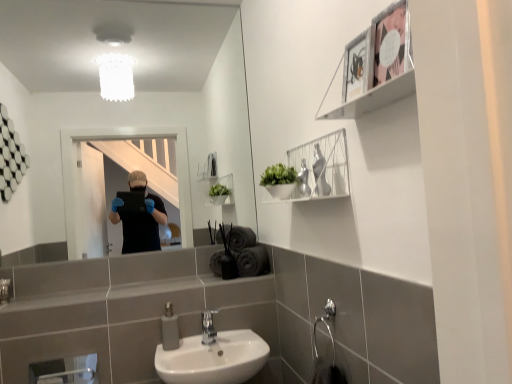
Question: Is metallic silver frame at upper right, which is the first cabinet from front to back, to the right of clear glass mirror at upper center from the viewer's perspective?

Choices:
 (A) no
 (B) yes

Answer: (B)

Question: Is metallic silver frame at upper right, which ranks as the 2th cabinet in bottom-to-top order, further to the viewer compared to clear glass mirror at upper center?

Choices:
 (A) no
 (B) yes

Answer: (A)

Question: From a real-world perspective, is metallic silver frame at upper right, which ranks as the 2th cabinet in bottom-to-top order, physically above clear glass mirror at upper center?

Choices:
 (A) no
 (B) yes

Answer: (A)

Question: From the image's perspective, would you say metallic silver frame at upper right, the first cabinet from the top, is shown under clear glass mirror at upper center?

Choices:
 (A) no
 (B) yes

Answer: (B)

Question: Is metallic silver frame at upper right, the 2th cabinet positioned from the back, next to clear glass mirror at upper center and touching it?

Choices:
 (A) yes
 (B) no

Answer: (B)

Question: Considering the relative sizes of metallic silver frame at upper right, the 2th cabinet positioned from the back, and clear glass mirror at upper center in the image provided, is metallic silver frame at upper right, the 2th cabinet positioned from the back, bigger than clear glass mirror at upper center?

Choices:
 (A) yes
 (B) no

Answer: (B)

Question: Is white wire shelf at upper center, positioned as the 2th cabinet in front-to-back order, smaller than metallic silver picture frame at upper right?

Choices:
 (A) no
 (B) yes

Answer: (A)

Question: Does white wire shelf at upper center, placed as the second cabinet when sorted from top to bottom, turn towards metallic silver picture frame at upper right?

Choices:
 (A) yes
 (B) no

Answer: (B)

Question: Is white wire shelf at upper center, placed as the second cabinet when sorted from top to bottom, closer to the viewer compared to metallic silver picture frame at upper right?

Choices:
 (A) no
 (B) yes

Answer: (A)

Question: From a real-world perspective, is white wire shelf at upper center, the first cabinet positioned from the bottom, located beneath metallic silver picture frame at upper right?

Choices:
 (A) no
 (B) yes

Answer: (B)

Question: Is metallic silver picture frame at upper right at the back of white wire shelf at upper center, which is counted as the 1th cabinet, starting from the back?

Choices:
 (A) yes
 (B) no

Answer: (B)

Question: Does white wire shelf at upper center, which is counted as the 1th cabinet, starting from the back, have a larger size compared to metallic silver picture frame at upper right?

Choices:
 (A) yes
 (B) no

Answer: (A)

Question: Is metallic silver frame at upper right, which is the first cabinet from front to back, not within white wire shelf at upper center, placed as the second cabinet when sorted from top to bottom?

Choices:
 (A) no
 (B) yes

Answer: (B)